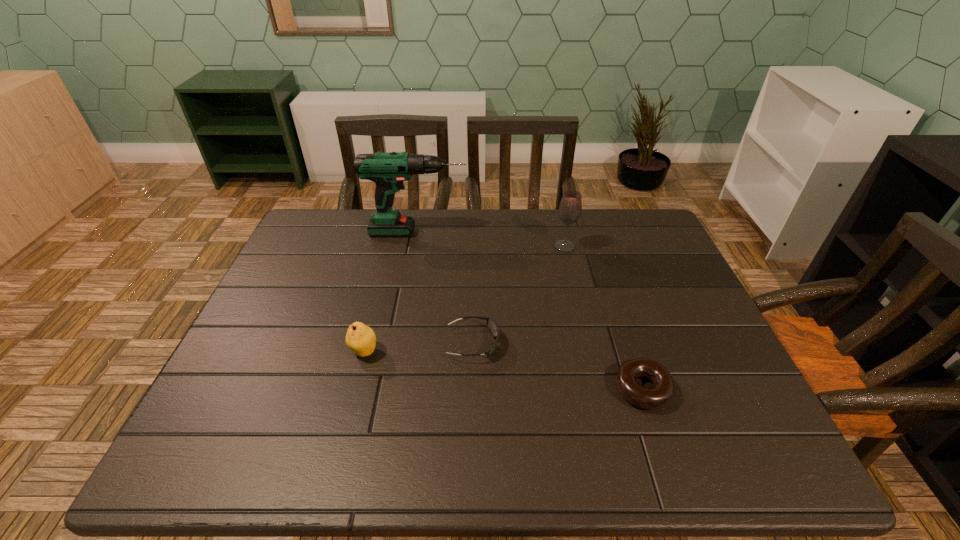
Identify the location of vacant area that satisfies the following two spatial constraints: 1. on the handle side of the farthest object; 2. on the left side of the nearest object. (390, 389).

Where is `vacant space that satisfies the following two spatial constraints: 1. on the handle side of the fourth object from left to right; 2. on the left side of the farthest object`? The width and height of the screenshot is (960, 540). vacant space that satisfies the following two spatial constraints: 1. on the handle side of the fourth object from left to right; 2. on the left side of the farthest object is located at coordinates (416, 247).

Find the location of `vacant space that satisfies the following two spatial constraints: 1. on the front side of the glass drink container; 2. on the lenses of the goggles`. vacant space that satisfies the following two spatial constraints: 1. on the front side of the glass drink container; 2. on the lenses of the goggles is located at coordinates (588, 343).

Locate an element on the screen. vacant area that satisfies the following two spatial constraints: 1. on the handle side of the tallest object; 2. on the back side of the doughnut is located at coordinates (390, 389).